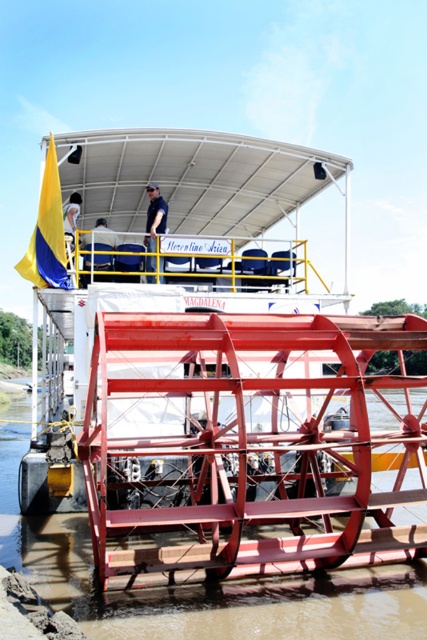
Consider the image. You are a tour guide on the Macarena paddlewheel boat. You need to hand out a brochure to a passenger wearing the dark blue uniform at upper center from your position near the brown metallic river at lower center. Can you reach them without moving? Please explain based on the distance between the two locations.

The brown metallic river at lower center and dark blue uniform at upper center are 6.18 meters apart. Since the distance is over 6 meters, you cannot reach them without moving closer.